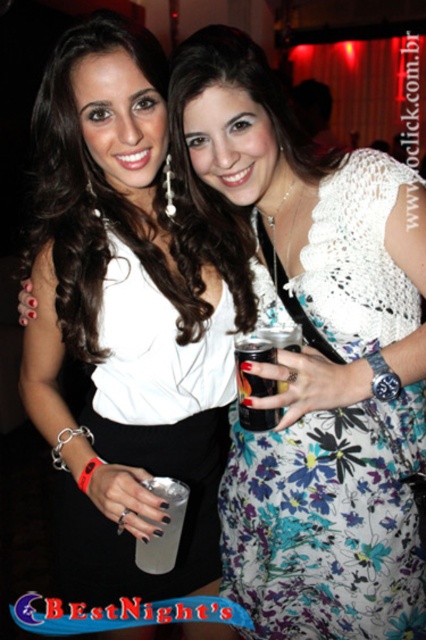
Is floral print dress at center below clear plastic cup at center?

No.

Can you confirm if floral print dress at center is thinner than clear plastic cup at center?

Incorrect, floral print dress at center's width is not less than clear plastic cup at center's.

Is point (331, 451) more distant than point (172, 564)?

Yes, it is behind point (172, 564).

You are a GUI agent. You are given a task and a screenshot of the screen. Output one action in this format:
    pyautogui.click(x=<x>, y=<y>)
    Task: Click on the floral print dress at center
    
    Given the screenshot: What is the action you would take?
    pyautogui.click(x=328, y=522)

Does white matte dress at center appear on the right side of floral print dress at center?

Incorrect, white matte dress at center is not on the right side of floral print dress at center.

Which is more to the right, white matte dress at center or floral print dress at center?

From the viewer's perspective, floral print dress at center appears more on the right side.

Between point (149, 595) and point (296, 490), which one is positioned in front?

Point (296, 490)

The width and height of the screenshot is (426, 640). Identify the location of white matte dress at center. pyautogui.click(x=127, y=316).

Is the position of white matte dress at center more distant than that of clear plastic cup at center?

Yes, white matte dress at center is further from the viewer.

The width and height of the screenshot is (426, 640). Describe the element at coordinates (127, 316) in the screenshot. I see `white matte dress at center` at that location.

Is point (63, 90) positioned in front of point (155, 492)?

No, (63, 90) is further to viewer.

Find the location of a particular element. This screenshot has width=426, height=640. white matte dress at center is located at coordinates (127, 316).